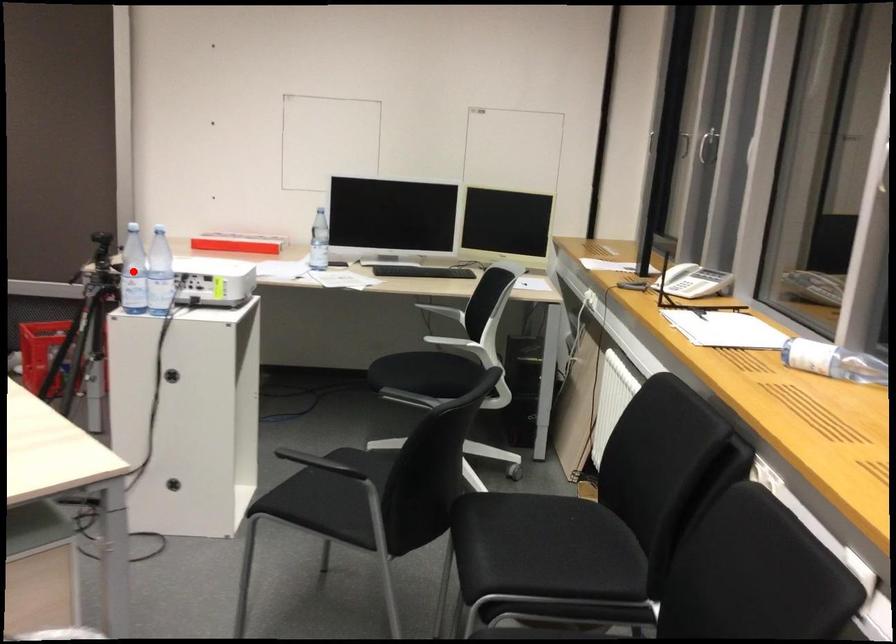
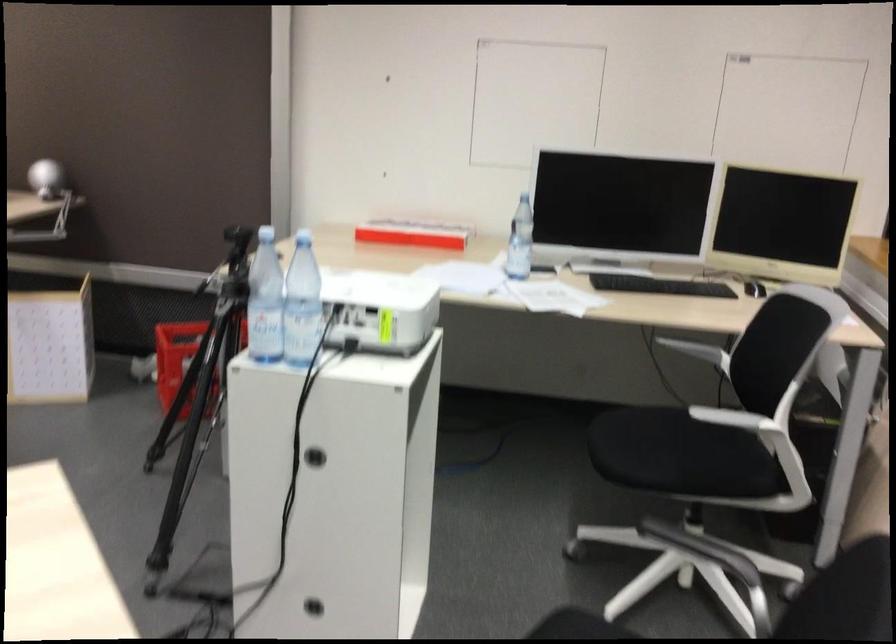
Question: I am providing you with two images of the same scene from different viewpoints. Image1 has a red point marked. In image2, the corresponding 3D location appears at what relative position? Reply with the corresponding letter.

Choices:
 (A) Closer
 (B) Farther

Answer: (A)